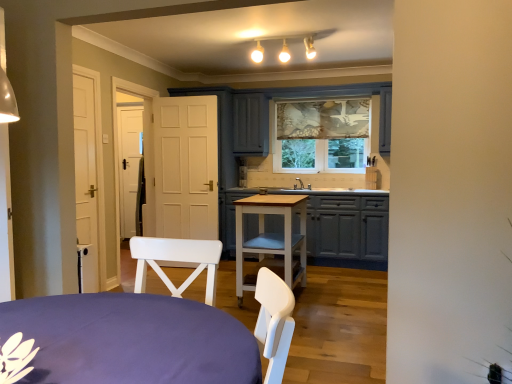
Question: Which direction should I rotate to look at light brown wooden table at center, arranged as the 2th table when viewed from the front, — up or down?

Choices:
 (A) up
 (B) down

Answer: (B)

Question: From the image's perspective, would you say purple fabric-covered table at lower left, marked as the 1th table in a front-to-back arrangement, is positioned over light brown wooden table at center, the first table positioned from the back?

Choices:
 (A) yes
 (B) no

Answer: (B)

Question: Is purple fabric-covered table at lower left, which is the 2th table from back to front, positioned beyond the bounds of light brown wooden table at center, the first table positioned from the back?

Choices:
 (A) yes
 (B) no

Answer: (A)

Question: Is purple fabric-covered table at lower left, marked as the 1th table in a front-to-back arrangement, further to the viewer compared to light brown wooden table at center, arranged as the 2th table when viewed from the front?

Choices:
 (A) yes
 (B) no

Answer: (B)

Question: Considering the relative sizes of purple fabric-covered table at lower left, which is the 2th table from back to front, and light brown wooden table at center, the first table positioned from the back, in the image provided, is purple fabric-covered table at lower left, which is the 2th table from back to front, wider than light brown wooden table at center, the first table positioned from the back,?

Choices:
 (A) yes
 (B) no

Answer: (A)

Question: From a real-world perspective, is purple fabric-covered table at lower left, marked as the 1th table in a front-to-back arrangement, positioned under light brown wooden table at center, the first table positioned from the back, based on gravity?

Choices:
 (A) no
 (B) yes

Answer: (A)

Question: From the image's perspective, would you say purple fabric-covered table at lower left, which is the 2th table from back to front, is shown under light brown wooden table at center, the first table positioned from the back?

Choices:
 (A) no
 (B) yes

Answer: (B)

Question: Can you confirm if matte gray cabinets at center is positioned to the left of light brown wooden table at center, the first table positioned from the back?

Choices:
 (A) no
 (B) yes

Answer: (A)

Question: Does matte gray cabinets at center turn towards light brown wooden table at center, arranged as the 2th table when viewed from the front?

Choices:
 (A) no
 (B) yes

Answer: (B)

Question: From the image's perspective, is matte gray cabinets at center beneath light brown wooden table at center, arranged as the 2th table when viewed from the front?

Choices:
 (A) no
 (B) yes

Answer: (A)

Question: Is light brown wooden table at center, arranged as the 2th table when viewed from the front, surrounded by matte gray cabinets at center?

Choices:
 (A) no
 (B) yes

Answer: (A)

Question: Can you confirm if matte gray cabinets at center is bigger than light brown wooden table at center, the first table positioned from the back?

Choices:
 (A) yes
 (B) no

Answer: (A)

Question: Can you confirm if matte gray cabinets at center is shorter than light brown wooden table at center, the first table positioned from the back?

Choices:
 (A) no
 (B) yes

Answer: (A)

Question: Is light brown wooden table at center, arranged as the 2th table when viewed from the front, directly adjacent to purple fabric-covered table at lower left, marked as the 1th table in a front-to-back arrangement?

Choices:
 (A) yes
 (B) no

Answer: (B)